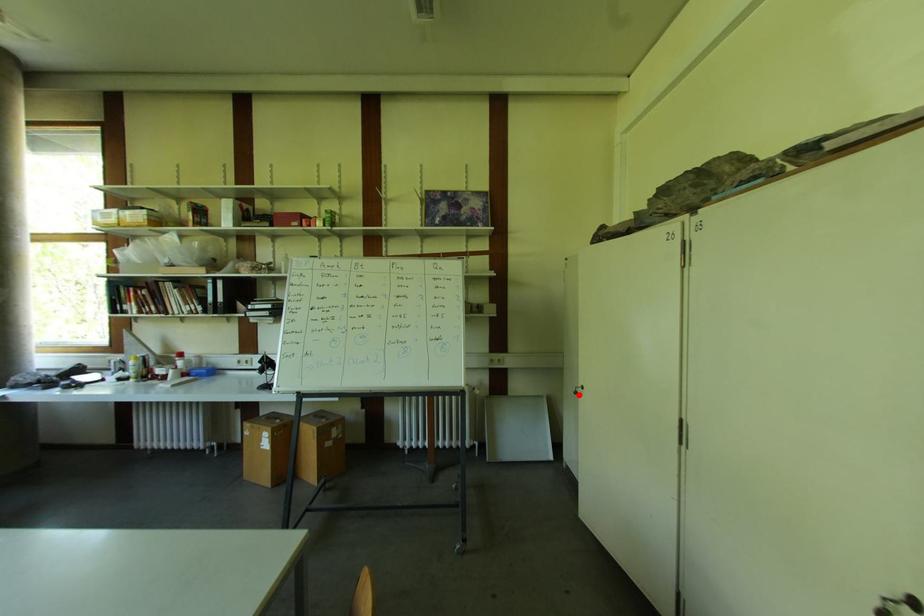
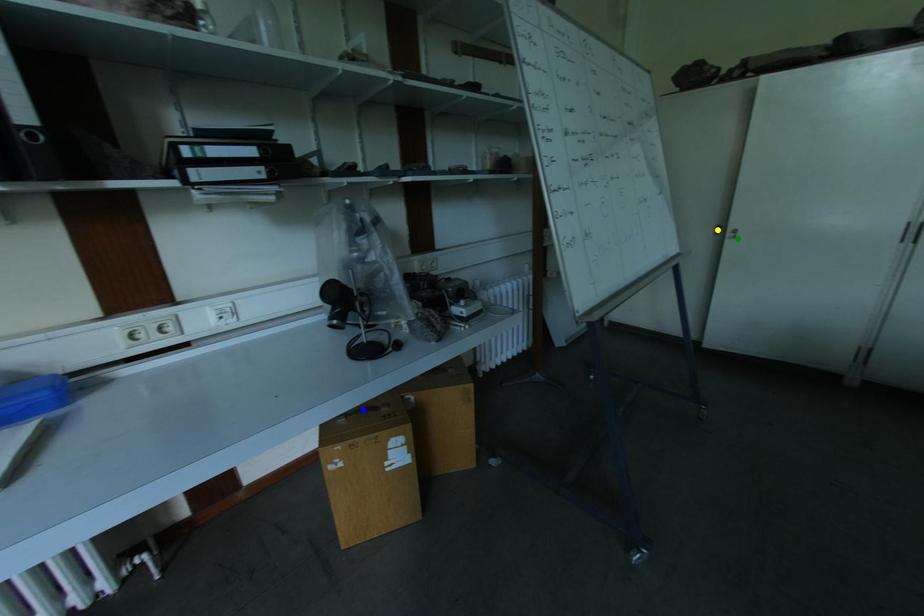
Question: I am providing you with two images of the same scene from different viewpoints. A red point is marked on the first image. You are given multiple points on the second image. Which point in image 2 represents the same 3d spot as the red point in image 1?

Choices:
 (A) green point
 (B) yellow point
 (C) blue point

Answer: (A)